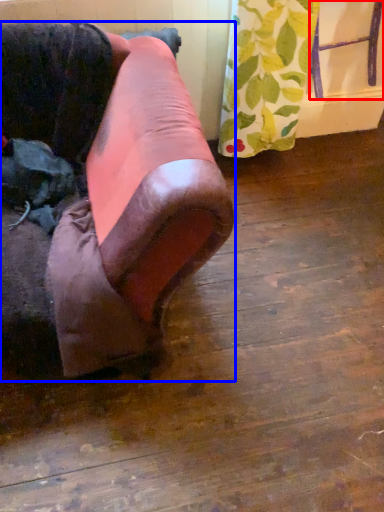
Question: Which object appears farthest to the camera in this image, furniture (highlighted by a red box) or furniture (highlighted by a blue box)?

Choices:
 (A) furniture
 (B) furniture

Answer: (A)